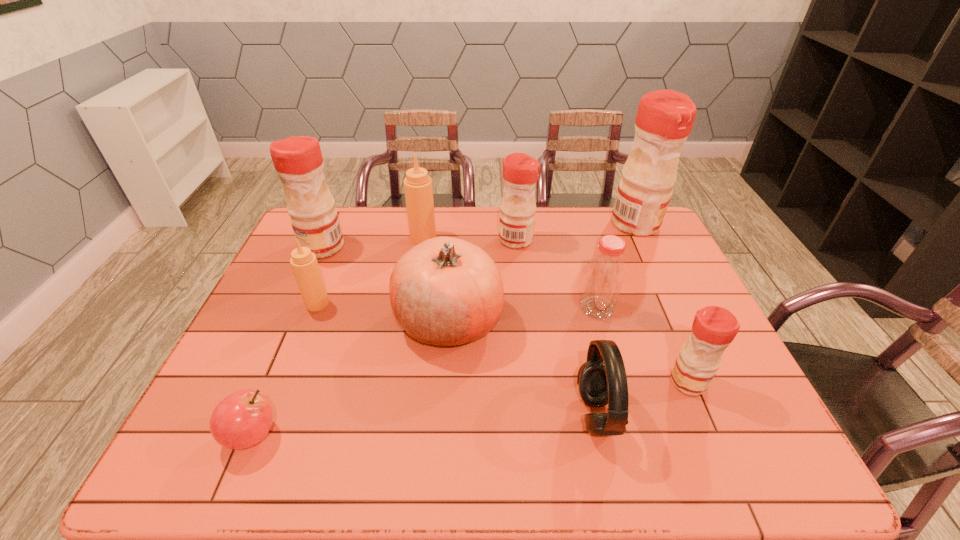
Find the location of a particular element. the tallest object is located at coordinates (665, 118).

You are a GUI agent. You are given a task and a screenshot of the screen. Output one action in this format:
    pyautogui.click(x=<x>, y=<y>)
    Task: Click on the biggest red condiment
    This screenshot has width=960, height=540.
    Given the screenshot: What is the action you would take?
    pyautogui.click(x=665, y=118)

The image size is (960, 540). Find the location of `the leftmost red condiment`. the leftmost red condiment is located at coordinates click(x=298, y=161).

Locate an element on the screen. The height and width of the screenshot is (540, 960). the second biggest red condiment is located at coordinates (298, 161).

Where is `the farther tan condiment`? The width and height of the screenshot is (960, 540). the farther tan condiment is located at coordinates (418, 189).

Identify the location of the fourth condiment from right to left. (418, 189).

You are a GUI agent. You are given a task and a screenshot of the screen. Output one action in this format:
    pyautogui.click(x=<x>, y=<y>)
    Task: Click on the third condiment from right to left
    The image size is (960, 540).
    Given the screenshot: What is the action you would take?
    pyautogui.click(x=520, y=171)

Where is `the second red condiment from left to right`? Image resolution: width=960 pixels, height=540 pixels. the second red condiment from left to right is located at coordinates (520, 171).

The height and width of the screenshot is (540, 960). Identify the location of orange pumpkin. (445, 291).

Locate an element on the screen. Image resolution: width=960 pixels, height=540 pixels. bottle is located at coordinates (605, 274).